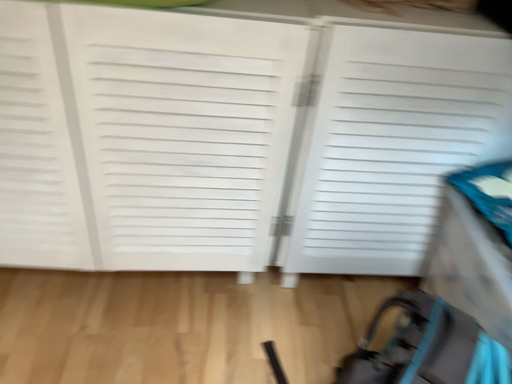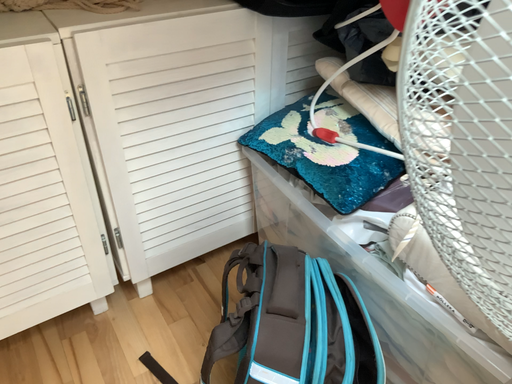
Question: Which way did the camera rotate in the video?

Choices:
 (A) rotated left
 (B) rotated right

Answer: (B)